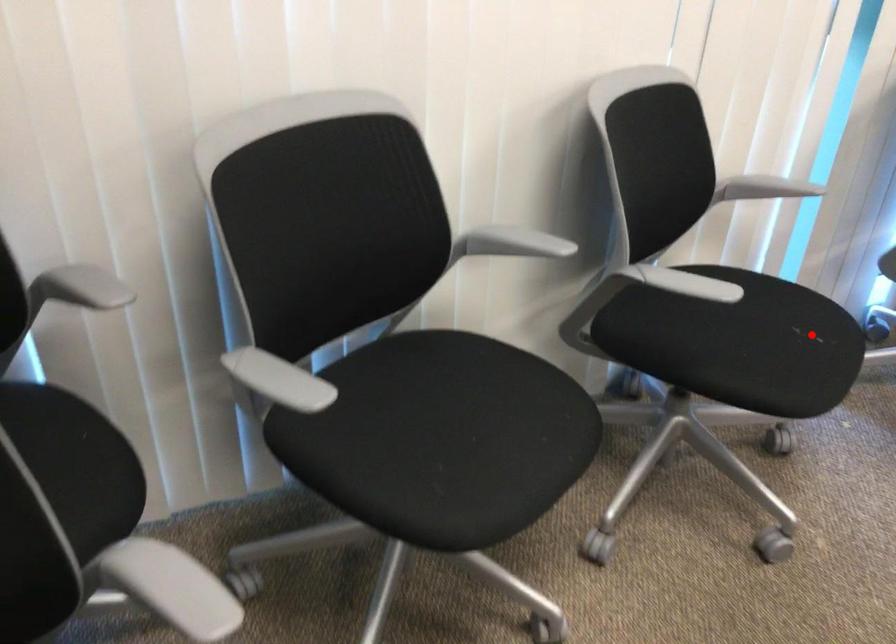
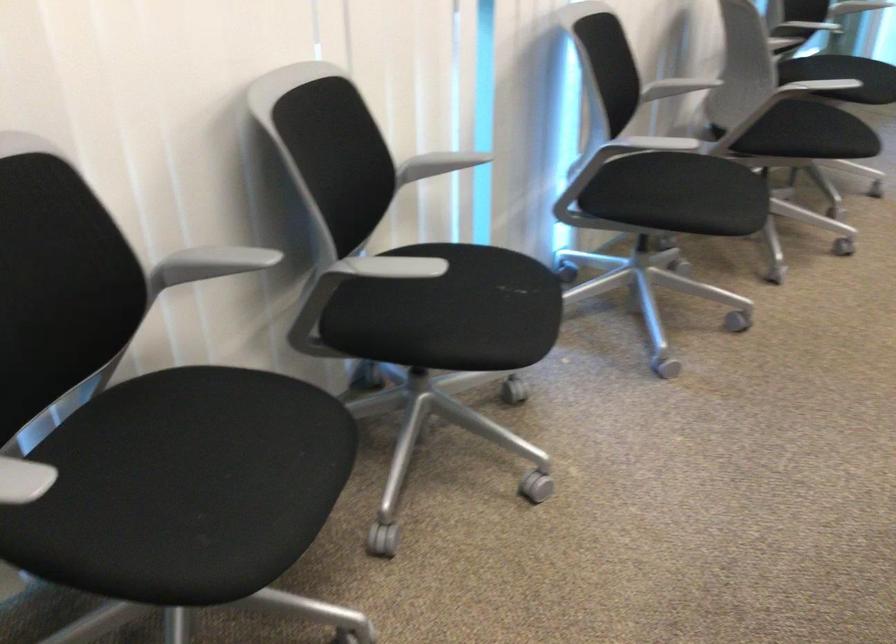
In the second image, find the point that corresponds to the highlighted location in the first image.

(515, 287)